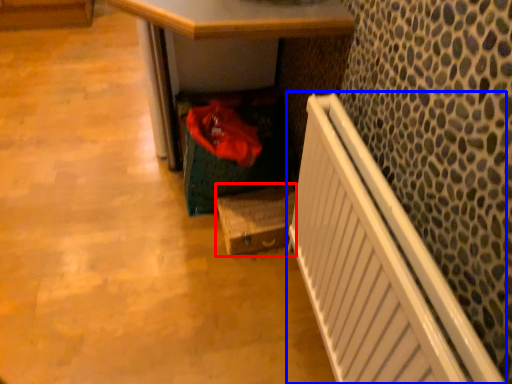
Question: Which object appears closest to the camera in this image, box (highlighted by a red box) or radiator (highlighted by a blue box)?

Choices:
 (A) box
 (B) radiator

Answer: (B)